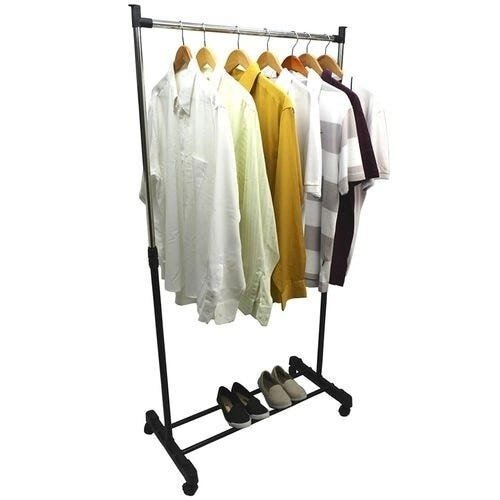
The height and width of the screenshot is (500, 500). Identify the location of hanger metal hooks. (182, 33), (204, 34), (239, 37), (267, 41), (296, 43), (309, 42), (326, 45).